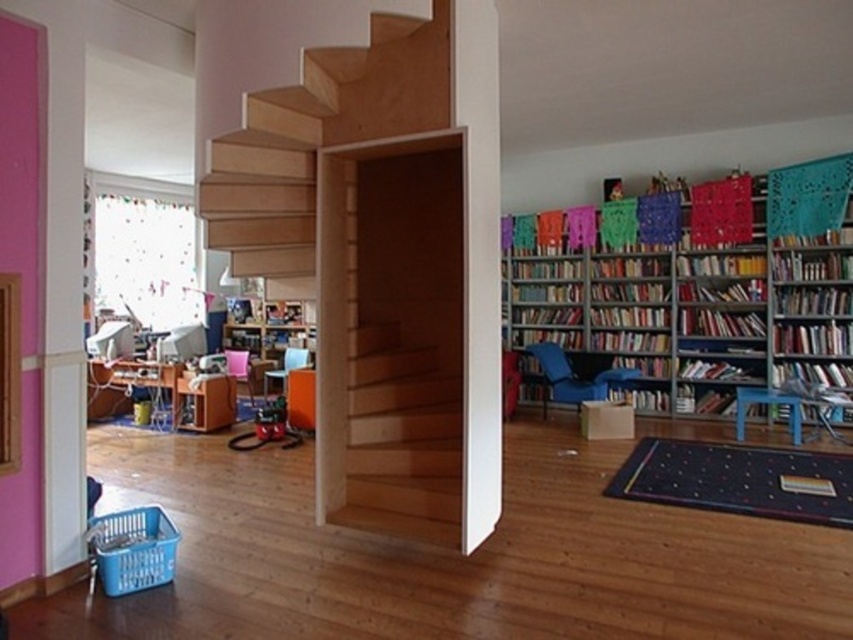
Which is behind, point (296, 268) or point (776, 342)?

Positioned behind is point (776, 342).

Is wooden stairs at center above hardcover book at upper right?

Yes, wooden stairs at center is above hardcover book at upper right.

The image size is (853, 640). Describe the element at coordinates (315, 138) in the screenshot. I see `wooden stairs at center` at that location.

In order to click on wooden stairs at center in this screenshot , I will do `click(315, 138)`.

Where is `metallic silver bookcase at right`? This screenshot has height=640, width=853. metallic silver bookcase at right is located at coordinates (677, 298).

Which is more to the right, metallic silver bookcase at right or hardcover book at right?

hardcover book at right is more to the right.

Does point (822, 355) come farther from viewer compared to point (839, 292)?

Yes, point (822, 355) is farther from viewer.

Locate an element on the screen. metallic silver bookcase at right is located at coordinates click(677, 298).

Does hardcover book at upper right come in front of hardcover book at right?

A: Yes, it is.

Can you confirm if hardcover book at upper right is thinner than hardcover book at right?

In fact, hardcover book at upper right might be wider than hardcover book at right.

I want to click on hardcover book at upper right, so click(x=813, y=339).